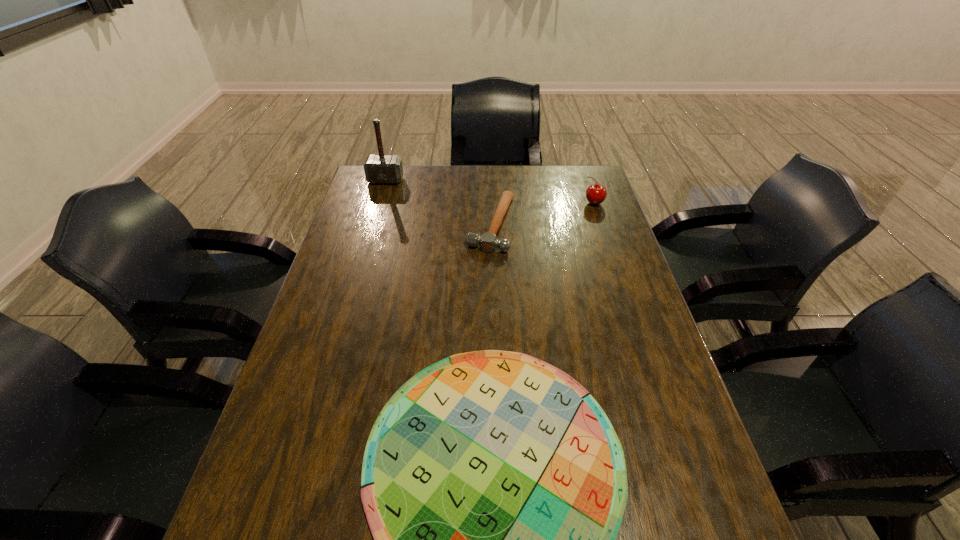
Where is `the tallest object`? This screenshot has height=540, width=960. the tallest object is located at coordinates (379, 169).

The width and height of the screenshot is (960, 540). I want to click on the farthest object, so click(379, 169).

The height and width of the screenshot is (540, 960). In order to click on the rightmost object in this screenshot , I will do `click(595, 193)`.

Image resolution: width=960 pixels, height=540 pixels. Find the location of `the third shortest object`. the third shortest object is located at coordinates (595, 193).

The height and width of the screenshot is (540, 960). I want to click on the third tallest object, so click(488, 242).

You are a GUI agent. You are given a task and a screenshot of the screen. Output one action in this format:
    pyautogui.click(x=<x>, y=<y>)
    Task: Click on the shorter hammer
    Image resolution: width=960 pixels, height=540 pixels.
    Given the screenshot: What is the action you would take?
    pyautogui.click(x=488, y=242)

Locate an element on the screen. free location located on the right of the taller hammer is located at coordinates (468, 180).

This screenshot has width=960, height=540. I want to click on blank space located 0.190m on the left of the rightmost object, so click(532, 203).

Locate an element on the screen. vacant point located 0.320m on the front of the nearer hammer is located at coordinates (495, 334).

Locate an element on the screen. The width and height of the screenshot is (960, 540). cherry present at the far edge is located at coordinates (595, 193).